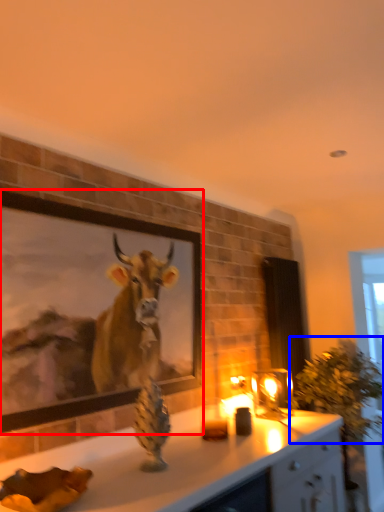
Question: Among these objects, which one is farthest to the camera, picture frame (highlighted by a red box) or plant (highlighted by a blue box)?

Choices:
 (A) picture frame
 (B) plant

Answer: (B)